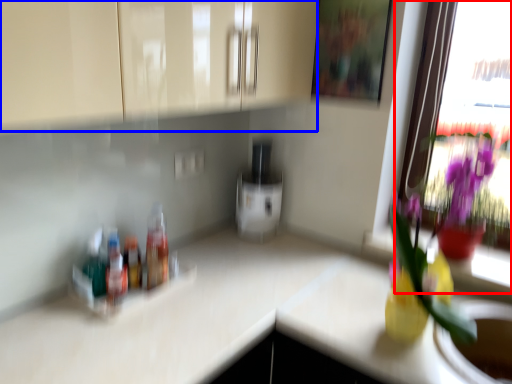
Question: Which object is closer to the camera taking this photo, window (highlighted by a red box) or cabinetry (highlighted by a blue box)?

Choices:
 (A) window
 (B) cabinetry

Answer: (B)